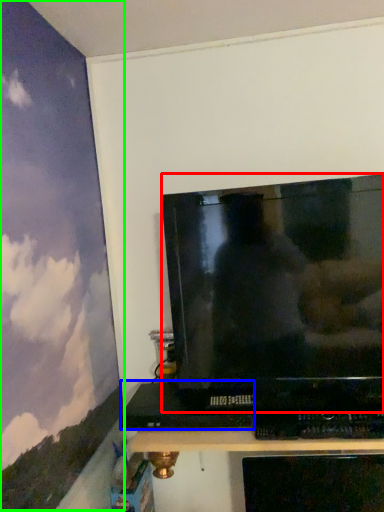
Question: Which is nearer to the television (highlighted by a red box)? computer (highlighted by a blue box) or backdrop (highlighted by a green box).

Choices:
 (A) computer
 (B) backdrop

Answer: (A)